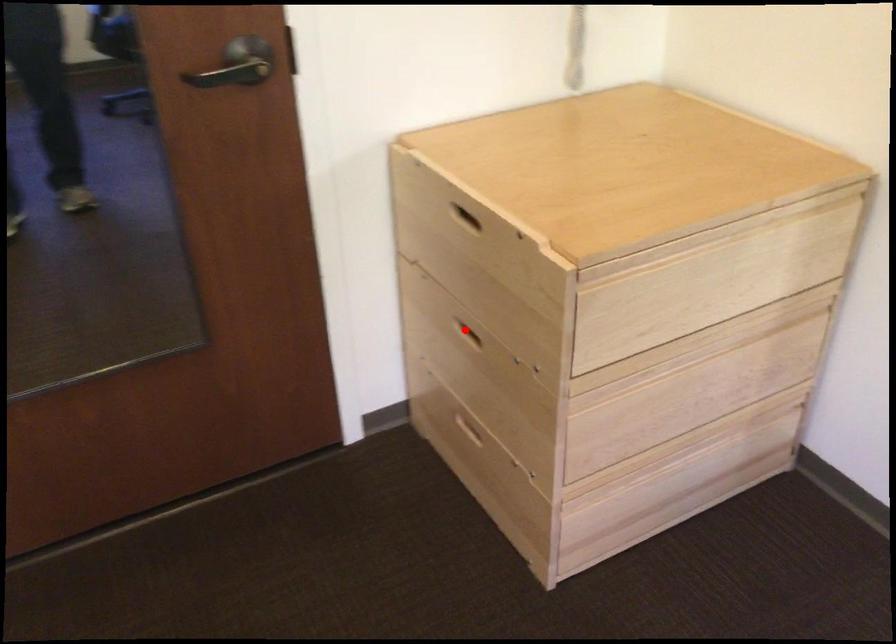
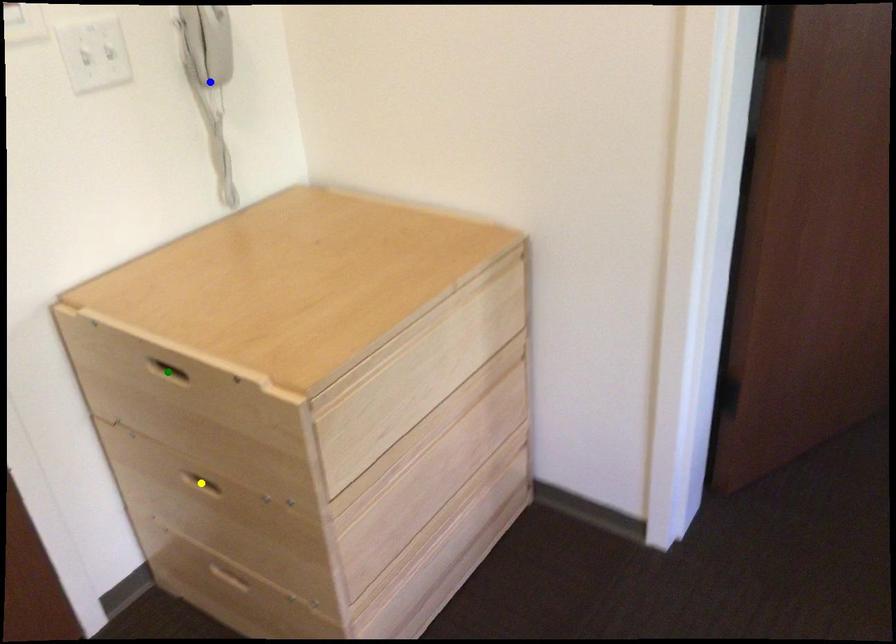
Question: I am providing you with two images of the same scene from different viewpoints. A red point is marked on the first image. You are given multiple points on the second image. Can you choose the point in image 2 that corresponds to the point in image 1?

Choices:
 (A) yellow point
 (B) green point
 (C) blue point

Answer: (A)